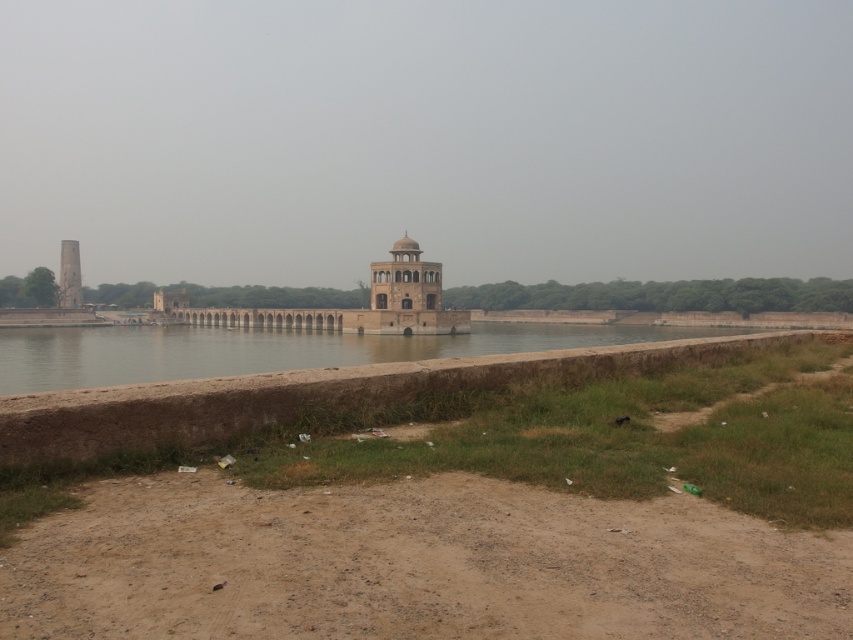
You are an architect visiting the riverside scene. You need to determine which structure has a greater horizontal span between its leftmost and rightmost points. Which one is wider? The smooth stone palace at center or the smooth white tower at left?

The smooth stone palace at center has a greater horizontal span between its leftmost and rightmost points compared to the smooth white tower at left because its width is larger.

You are an architect planning to construct a new building between the smooth stone palace at center and the smooth white tower at left. Considering their sizes, which building should you use as a reference for scale to ensure the new structure doesn

The smooth stone palace at center is larger than the smooth white tower at left. To maintain proper scale, the architect should use the smooth stone palace at center as a reference for the new building to ensure it aligns with the existing structures.

You are an architect examining the riverside scene. You need to determine which structure, the smooth stone palace at center or the smooth white tower at left, has a greater height. Based on the scene, which one is taller?

The smooth white tower at left is taller than the smooth stone palace at center.